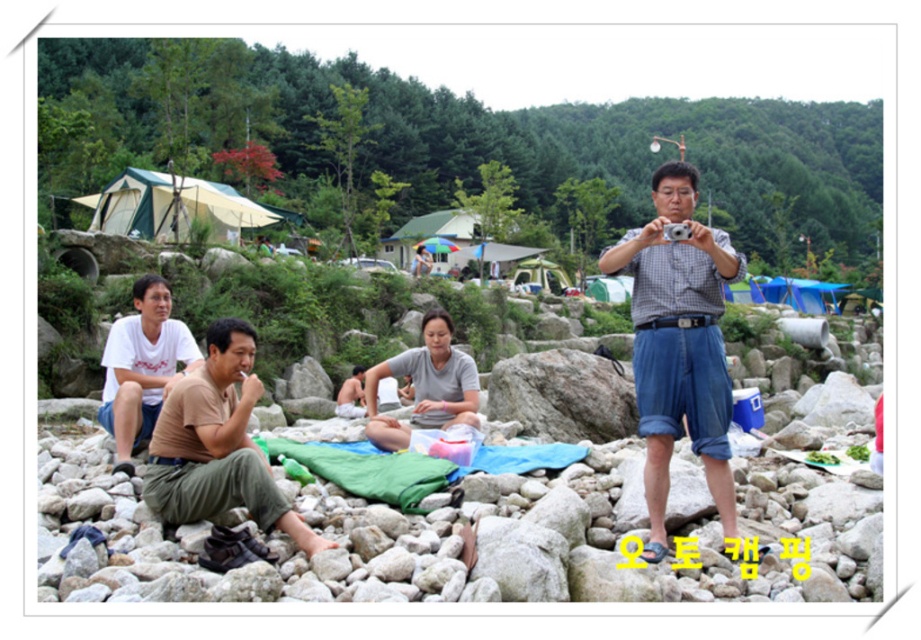
The image size is (921, 640). What are the coordinates of `checkered fabric shirt at center` in the screenshot? It's located at (679, 344).

Is point (649, 490) positioned in front of point (175, 422)?

Yes, point (649, 490) is closer to viewer.

What do you see at coordinates (679, 344) in the screenshot? This screenshot has width=921, height=640. I see `checkered fabric shirt at center` at bounding box center [679, 344].

At what (x,y) coordinates should I click in order to perform the action: click on checkered fabric shirt at center. Please return your answer as a coordinate pair (x, y). Image resolution: width=921 pixels, height=640 pixels. Looking at the image, I should click on (679, 344).

Is point (733, 493) farther from camera compared to point (136, 324)?

No, (733, 493) is closer to viewer.

Is point (674, 218) closer to viewer compared to point (126, 365)?

Yes.

Find the location of a particular element. checkered fabric shirt at center is located at coordinates click(x=679, y=344).

Is brown cotton shirt at lower left to the left of white cotton shirt at left from the viewer's perspective?

No, brown cotton shirt at lower left is not to the left of white cotton shirt at left.

Which is in front, point (239, 432) or point (114, 323)?

Point (239, 432)

Does point (255, 392) come closer to viewer compared to point (123, 356)?

Yes, point (255, 392) is closer to viewer.

In order to click on brown cotton shirt at lower left in this screenshot , I will do `click(218, 444)`.